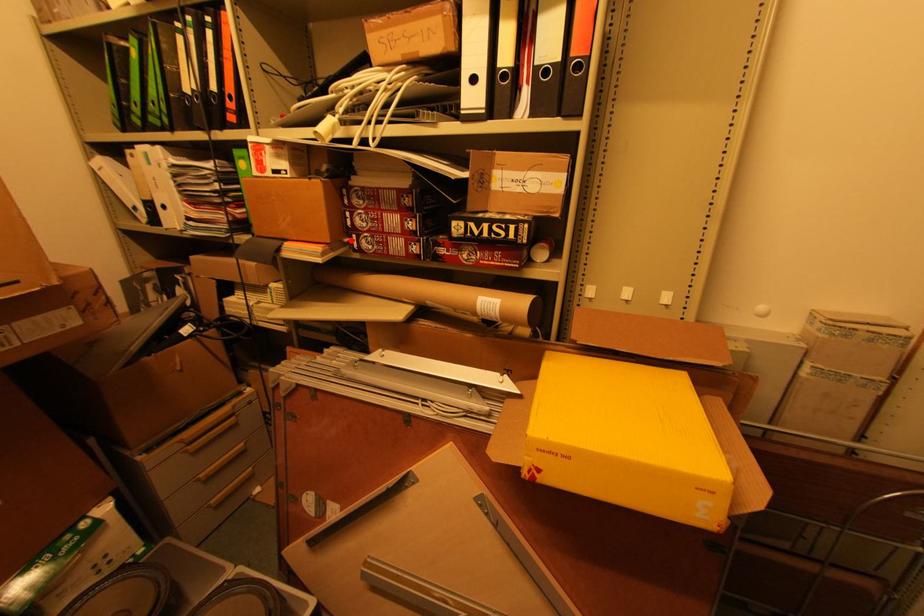
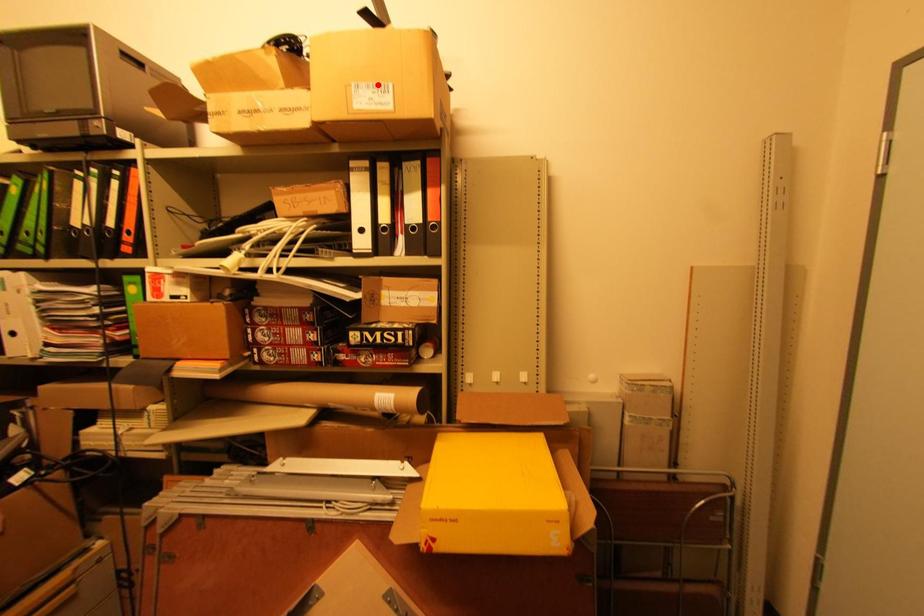
I am providing you with two images of the same scene from different viewpoints. A red point is marked on the first image and another point is marked on the second image. Is the marked point in image1 the same physical position as the marked point in image2?

No